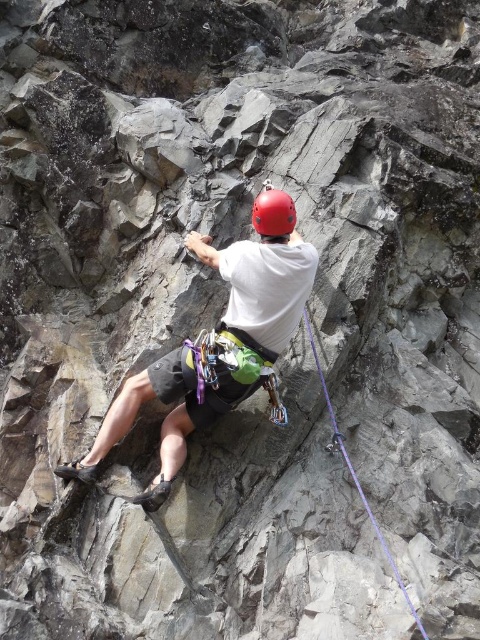
Is purple synthetic rope at center further to the viewer compared to matte red helmet at center?

No, purple synthetic rope at center is in front of matte red helmet at center.

Between purple synthetic rope at center and matte red helmet at center, which one is positioned higher?

matte red helmet at center

Find the location of `purple synthetic rope at center`. purple synthetic rope at center is located at coordinates (357, 476).

You are a GUI agent. You are given a task and a screenshot of the screen. Output one action in this format:
    pyautogui.click(x=<x>, y=<y>)
    Task: Click on the purple synthetic rope at center
    
    Given the screenshot: What is the action you would take?
    pyautogui.click(x=357, y=476)

In the scene shown: Does matte white helmet at center have a lesser height compared to purple synthetic rope at center?

Incorrect, matte white helmet at center's height does not fall short of purple synthetic rope at center's.

Based on the photo, is matte white helmet at center to the left of purple synthetic rope at center from the viewer's perspective?

Indeed, matte white helmet at center is positioned on the left side of purple synthetic rope at center.

Is point (303, 300) closer to camera compared to point (361, 499)?

Yes.

Locate an element on the screen. Image resolution: width=480 pixels, height=640 pixels. matte white helmet at center is located at coordinates (214, 353).

Between matte white helmet at center and matte red helmet at center, which one appears on the left side from the viewer's perspective?

From the viewer's perspective, matte white helmet at center appears more on the left side.

Who is more distant from viewer, (242, 285) or (282, 228)?

The point (282, 228) is behind.

Which is in front, point (252, 288) or point (274, 230)?

Point (252, 288)

I want to click on matte white helmet at center, so click(x=214, y=353).